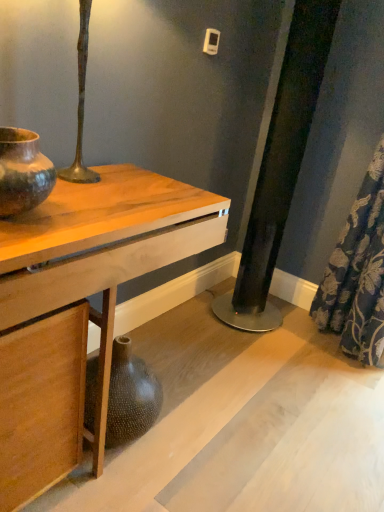
Locate an element on the screen. vacant area to the right of matte brown ceramic vase at left is located at coordinates click(x=87, y=221).